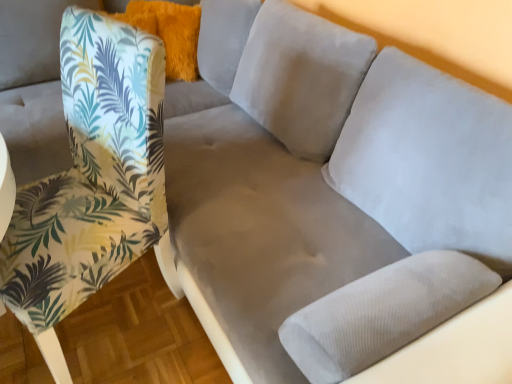
Question: Is printed fabric chair at left inside the boundaries of fluffy orange pillow at upper left, or outside?

Choices:
 (A) inside
 (B) outside

Answer: (B)

Question: Looking at the image, does printed fabric chair at left seem bigger or smaller compared to fluffy orange pillow at upper left?

Choices:
 (A) small
 (B) big

Answer: (B)

Question: Relative to fluffy orange pillow at upper left, is printed fabric chair at left in front or behind?

Choices:
 (A) behind
 (B) front

Answer: (B)

Question: From the image's perspective, is fluffy orange pillow at upper left positioned above or below printed fabric chair at left?

Choices:
 (A) below
 (B) above

Answer: (B)

Question: Do you think fluffy orange pillow at upper left is within printed fabric chair at left, or outside of it?

Choices:
 (A) outside
 (B) inside

Answer: (A)

Question: Is fluffy orange pillow at upper left bigger or smaller than printed fabric chair at left?

Choices:
 (A) big
 (B) small

Answer: (B)

Question: Does point (181, 44) appear closer or farther from the camera than point (61, 195)?

Choices:
 (A) farther
 (B) closer

Answer: (A)